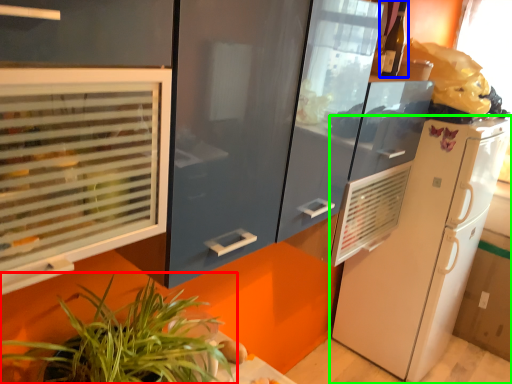
Question: Which is farther away from houseplant (highlighted by a red box)? wine bottle (highlighted by a blue box) or refrigerator (highlighted by a green box)?

Choices:
 (A) wine bottle
 (B) refrigerator

Answer: (B)